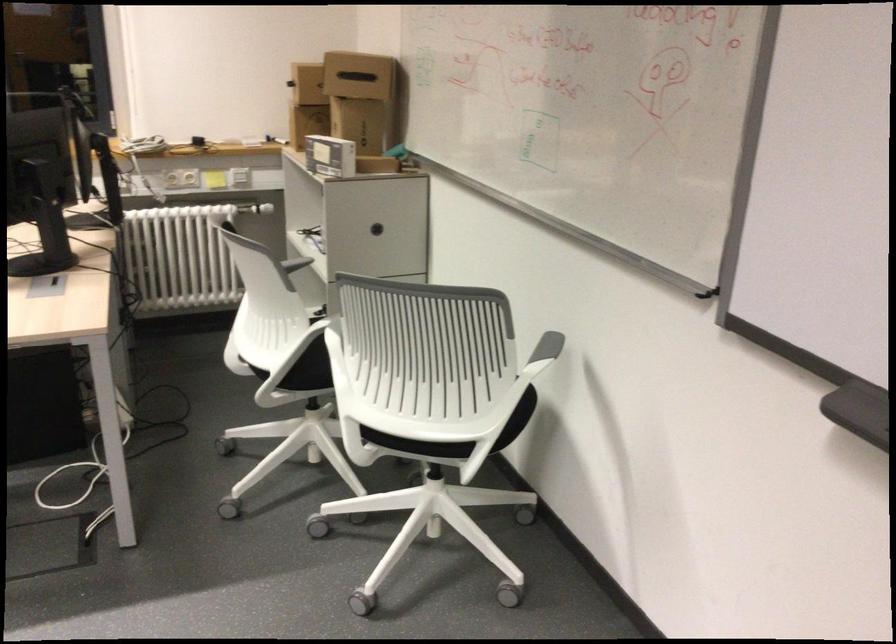
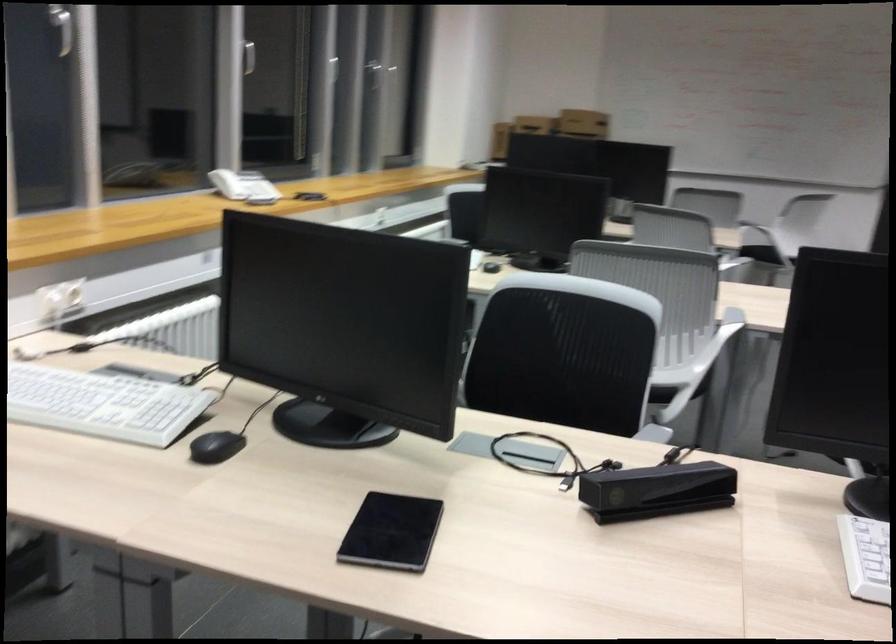
Question: I am providing you with two images of the same scene from different viewpoints. After the viewpoint changes to image2, which objects are now occluded?

Choices:
 (A) black computer mouse
 (B) grey bathroom scale
 (C) black sensor device
 (D) cardboard box

Answer: (D)